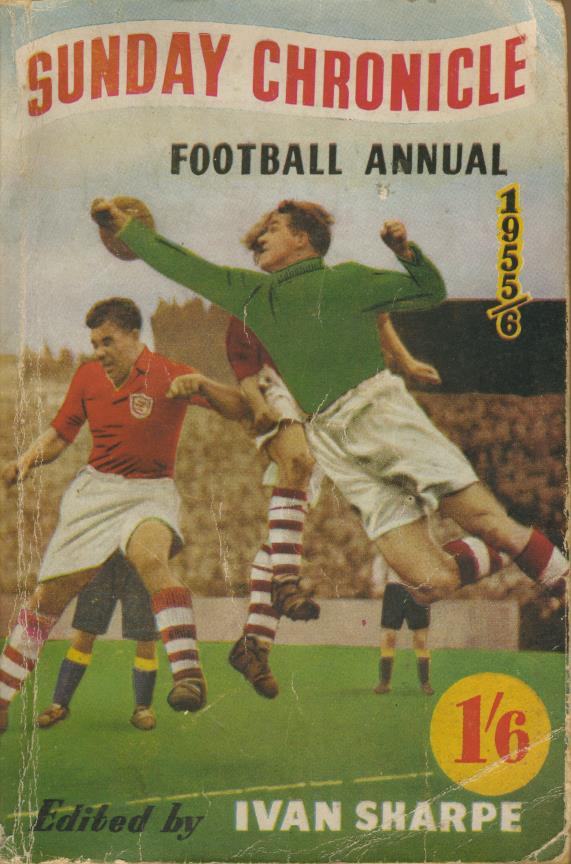
Find the location of a particular element. This screenshot has height=864, width=571. sock is located at coordinates pos(383,665).